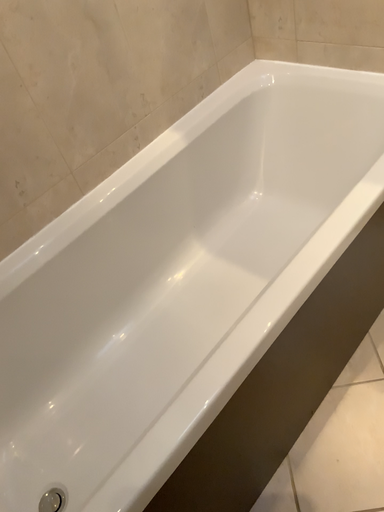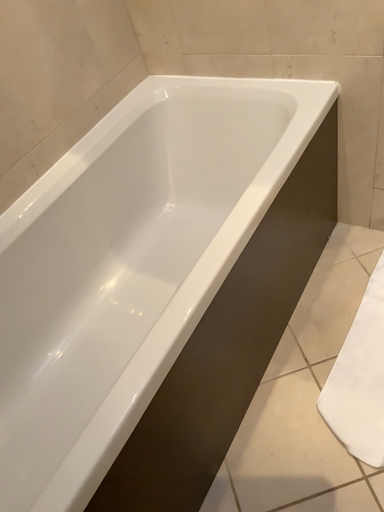
Question: Which way did the camera rotate in the video?

Choices:
 (A) rotated right
 (B) rotated left

Answer: (A)